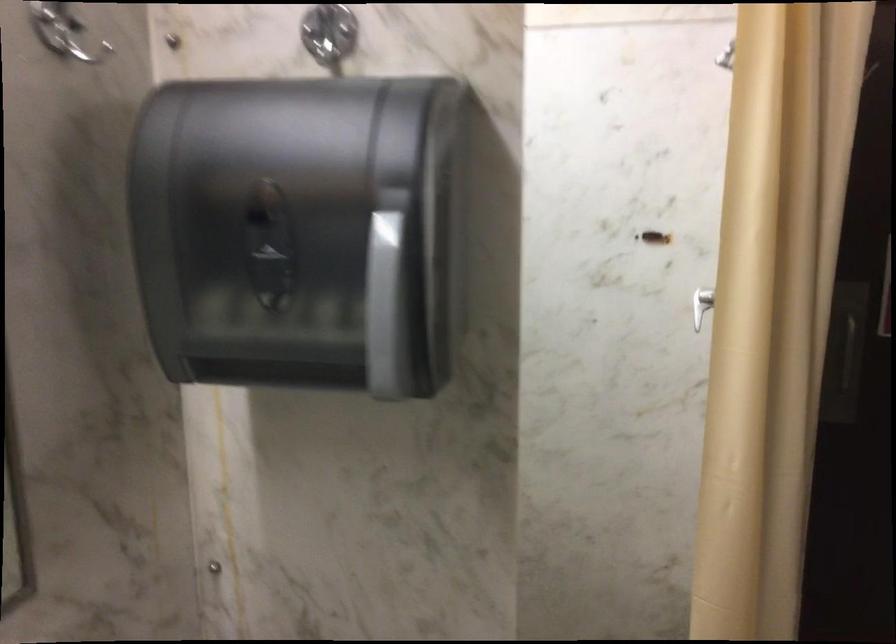
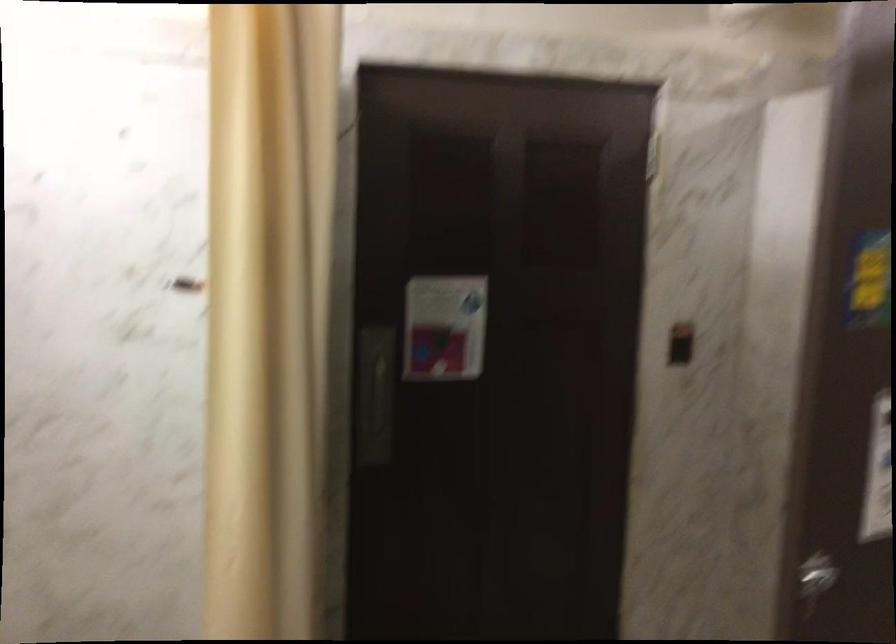
Question: The images are taken continuously from a first-person perspective. In which direction are you moving?

Choices:
 (A) Left
 (B) Right
 (C) Forward
 (D) Backward

Answer: (B)